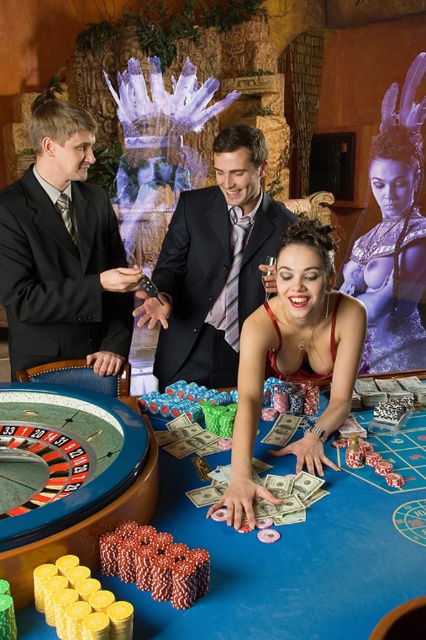
You are a casino employee who needs to place a new decorative plant between the blue felt table at center and the shiny black suit at center. The plant requires a minimum of 36 inches of space to be placed safely. Based on the scene, can you determine if there is enough space between them?

The blue felt table at center is 32.72 inches from the shiny black suit at center. Since the required space for the plant is 36 inches, there is insufficient space between them to safely place the plant.

You are a security guard in the casino and notice the blue felt table at center and the shiny black suit at center. Which object is closer to the floor?

The blue felt table at center is positioned under the shiny black suit at center, so the blue felt table at center is closer to the floor.